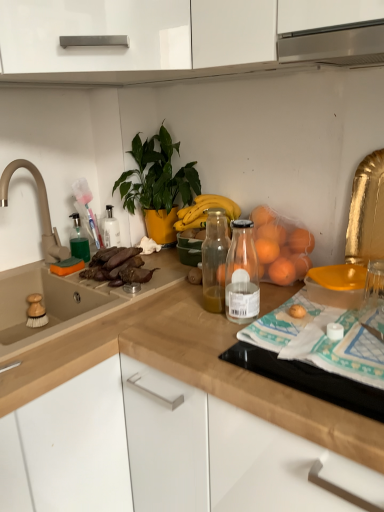
Question: Is green glossy plant at upper center completely or partially outside of wooden at upper center, which ranks as the second countertop in top-to-bottom order?

Choices:
 (A) no
 (B) yes

Answer: (B)

Question: Is green glossy plant at upper center positioned before wooden at upper center, which ranks as the second countertop in top-to-bottom order?

Choices:
 (A) yes
 (B) no

Answer: (B)

Question: Is green glossy plant at upper center at the right side of wooden at upper center, which ranks as the second countertop in top-to-bottom order?

Choices:
 (A) yes
 (B) no

Answer: (B)

Question: Does green glossy plant at upper center come behind wooden at upper center, which ranks as the second countertop in top-to-bottom order?

Choices:
 (A) yes
 (B) no

Answer: (A)

Question: Is green glossy plant at upper center at the left side of wooden at upper center, which is counted as the first countertop, starting from the bottom?

Choices:
 (A) yes
 (B) no

Answer: (A)

Question: Can you confirm if green glossy plant at upper center is wider than wooden at upper center, which ranks as the second countertop in top-to-bottom order?

Choices:
 (A) no
 (B) yes

Answer: (A)

Question: Is wooden at upper center, which ranks as the second countertop in top-to-bottom order, further to the viewer compared to beige matte faucet at left?

Choices:
 (A) yes
 (B) no

Answer: (B)

Question: From a real-world perspective, is wooden at upper center, which ranks as the second countertop in top-to-bottom order, below beige matte faucet at left?

Choices:
 (A) no
 (B) yes

Answer: (B)

Question: Is the depth of wooden at upper center, which is counted as the first countertop, starting from the bottom, less than that of beige matte faucet at left?

Choices:
 (A) yes
 (B) no

Answer: (A)

Question: Can you see wooden at upper center, which ranks as the second countertop in top-to-bottom order, touching beige matte faucet at left?

Choices:
 (A) yes
 (B) no

Answer: (B)

Question: Does wooden at upper center, which ranks as the second countertop in top-to-bottom order, have a greater height compared to beige matte faucet at left?

Choices:
 (A) yes
 (B) no

Answer: (A)

Question: From a real-world perspective, is wooden at upper center, which ranks as the second countertop in top-to-bottom order, positioned over beige matte faucet at left based on gravity?

Choices:
 (A) no
 (B) yes

Answer: (A)

Question: Is green translucent soap dispenser at left positioned in front of green glossy plant at upper center?

Choices:
 (A) yes
 (B) no

Answer: (B)